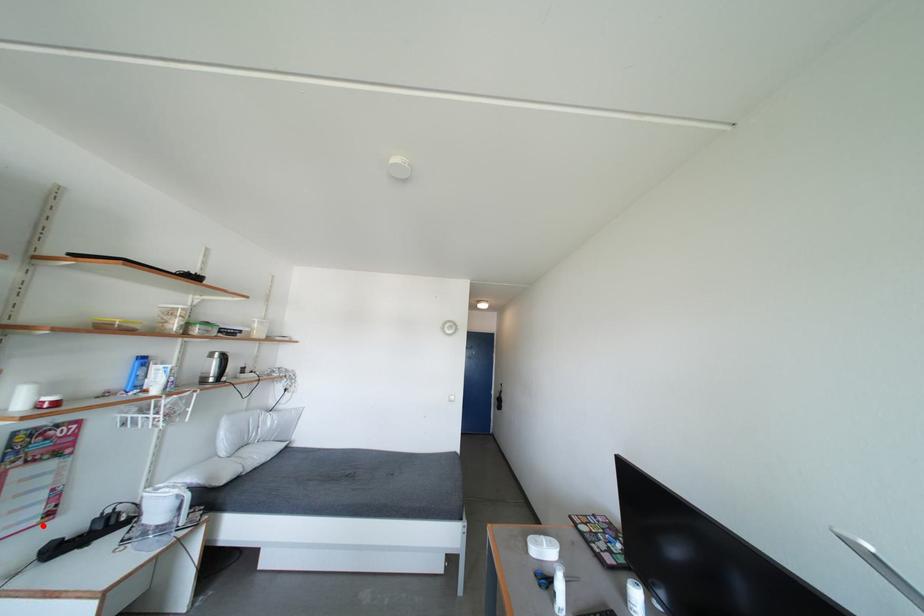
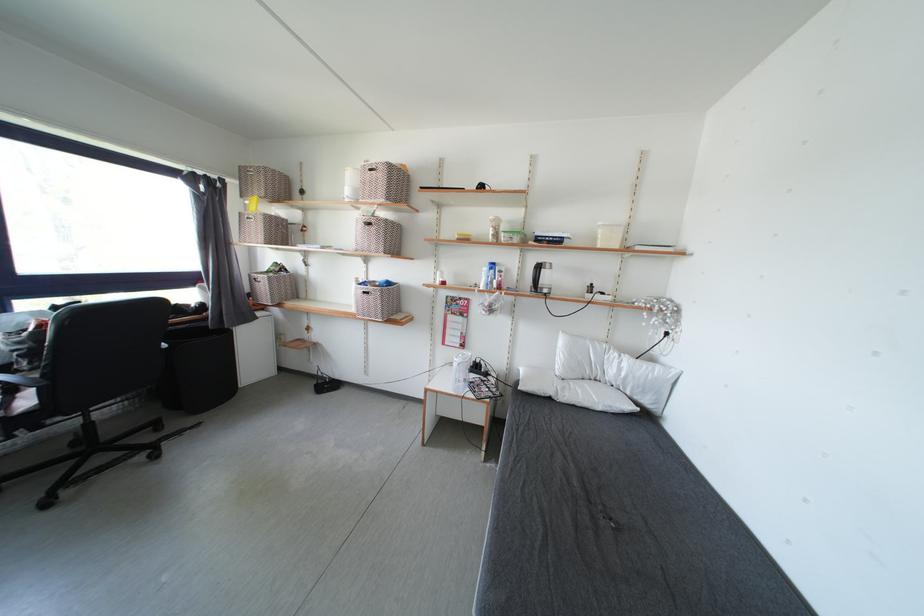
Find the pixel in the second image that matches the highlighted location in the first image.

(465, 351)